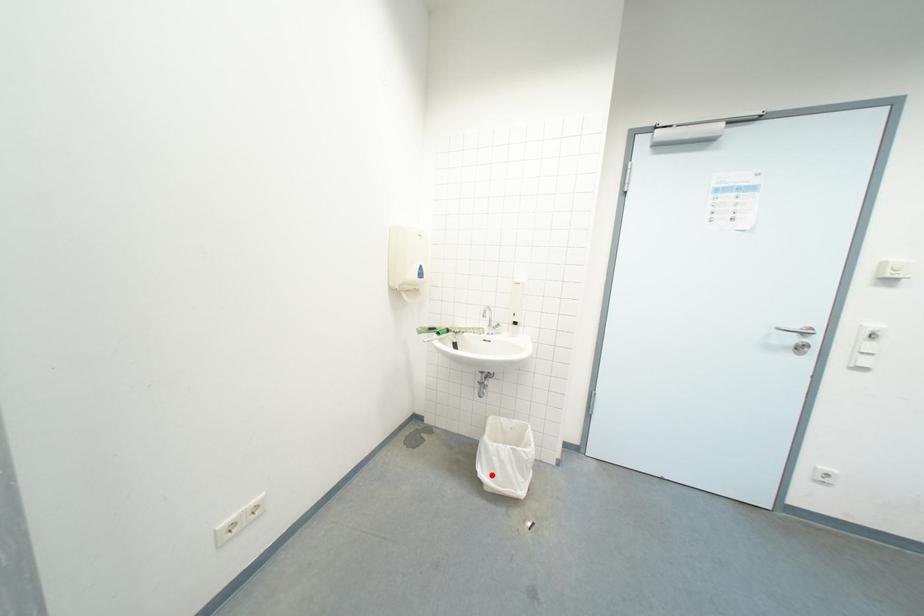
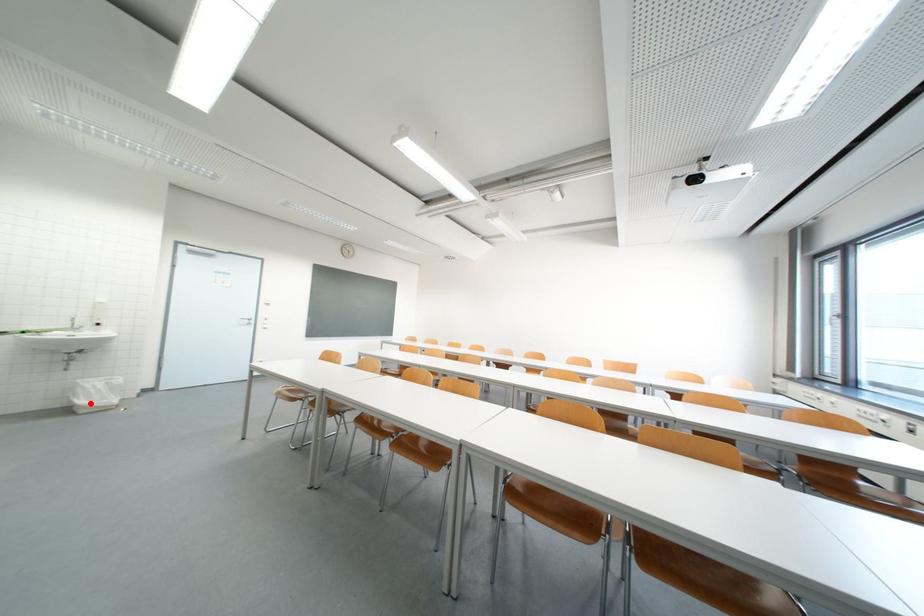
I am providing you with two images of the same scene from different viewpoints. A red point is marked on the first image and another point is marked on the second image. Does the point marked in image1 correspond to the same location as the one in image2?

Yes